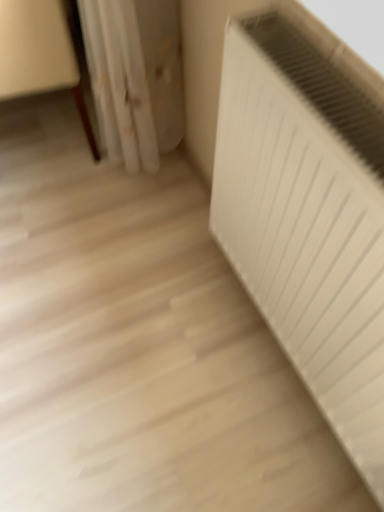
Question: Considering the positions of wooden floor at lower left and white matte radiator at right in the image, is wooden floor at lower left bigger or smaller than white matte radiator at right?

Choices:
 (A) big
 (B) small

Answer: (A)

Question: Is wooden floor at lower left taller or shorter than white matte radiator at right?

Choices:
 (A) tall
 (B) short

Answer: (A)

Question: Does point (4, 44) appear closer or farther from the camera than point (256, 164)?

Choices:
 (A) farther
 (B) closer

Answer: (A)

Question: Is white matte radiator at right taller or shorter than wooden floor at lower left?

Choices:
 (A) tall
 (B) short

Answer: (B)

Question: Is white matte radiator at right wider or thinner than wooden floor at lower left?

Choices:
 (A) thin
 (B) wide

Answer: (A)

Question: Considering their positions, is white matte radiator at right located in front of or behind wooden floor at lower left?

Choices:
 (A) front
 (B) behind

Answer: (A)

Question: From the image's perspective, is white matte radiator at right positioned above or below wooden floor at lower left?

Choices:
 (A) above
 (B) below

Answer: (B)